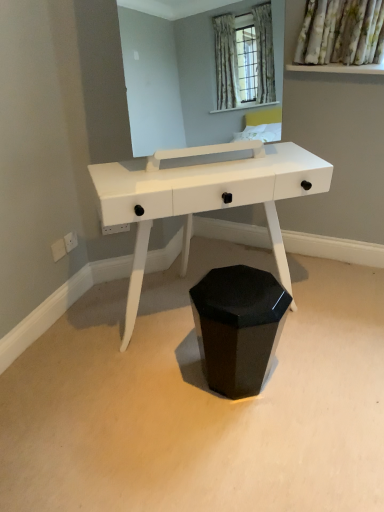
In order to face white glossy table at center, should I rotate leftwards or rightwards?

You should rotate right by 3.046 degrees.

Identify the location of white glossy table at center. (203, 197).

Describe the element at coordinates (203, 197) in the screenshot. I see `white glossy table at center` at that location.

Measure the distance between point (226, 198) and camera.

Point (226, 198) and camera are 5.21 feet apart from each other.

What is the approximate width of black glossy hexagonal waste bin at center?

Result: It is 30.12 centimeters.

Where is `black glossy hexagonal waste bin at center`? black glossy hexagonal waste bin at center is located at coordinates (238, 326).

The height and width of the screenshot is (512, 384). Describe the element at coordinates (238, 326) in the screenshot. I see `black glossy hexagonal waste bin at center` at that location.

The width and height of the screenshot is (384, 512). What are the coordinates of `white glossy table at center` in the screenshot? It's located at (203, 197).

Which object is positioned more to the right, black glossy hexagonal waste bin at center or white glossy table at center?

Positioned to the right is black glossy hexagonal waste bin at center.

Is black glossy hexagonal waste bin at center in front of white glossy table at center?

No, black glossy hexagonal waste bin at center is further to the viewer.

Is point (206, 285) behind point (126, 175)?

Yes, it is behind point (126, 175).

From the image's perspective, is black glossy hexagonal waste bin at center located above or below white glossy table at center?

From the image's perspective, black glossy hexagonal waste bin at center appears below white glossy table at center.

From a real-world perspective, which is physically below, black glossy hexagonal waste bin at center or white glossy table at center?

In real-world perspective, black glossy hexagonal waste bin at center is lower.

Is black glossy hexagonal waste bin at center wider or thinner than white glossy table at center?

black glossy hexagonal waste bin at center is thinner than white glossy table at center.

Based on the photo, considering the sizes of objects black glossy hexagonal waste bin at center and white glossy table at center in the image provided, who is shorter, black glossy hexagonal waste bin at center or white glossy table at center?

Standing shorter between the two is black glossy hexagonal waste bin at center.

Looking at the image, does black glossy hexagonal waste bin at center seem bigger or smaller compared to white glossy table at center?

Clearly, black glossy hexagonal waste bin at center is smaller in size than white glossy table at center.

Is white glossy table at center a part of black glossy hexagonal waste bin at center?

No, black glossy hexagonal waste bin at center does not contain white glossy table at center.

Is black glossy hexagonal waste bin at center far from white glossy table at center?

That's not correct — black glossy hexagonal waste bin at center is a little close to white glossy table at center.

In the scene shown: Is black glossy hexagonal waste bin at center positioned with its back to white glossy table at center?

black glossy hexagonal waste bin at center does not have its back to white glossy table at center.

How many degrees apart are the facing directions of black glossy hexagonal waste bin at center and white glossy table at center?

They differ by 173 degrees in their facing directions.

The height and width of the screenshot is (512, 384). Identify the location of waste container below the white glossy table at center (from a real-world perspective). (238, 326).

Considering the relative positions of white glossy table at center and black glossy hexagonal waste bin at center in the image provided, is white glossy table at center to the right of black glossy hexagonal waste bin at center from the viewer's perspective?

No, white glossy table at center is not to the right of black glossy hexagonal waste bin at center.

Between white glossy table at center and black glossy hexagonal waste bin at center, which one is positioned in front?

white glossy table at center is in front.

Does point (138, 263) appear closer or farther from the camera than point (252, 370)?

Point (138, 263) is farther from the camera than point (252, 370).

From the image's perspective, which object appears higher, white glossy table at center or black glossy hexagonal waste bin at center?

white glossy table at center appears higher in the image.

From a real-world perspective, is white glossy table at center positioned under black glossy hexagonal waste bin at center based on gravity?

No, from a real-world perspective, white glossy table at center is not below black glossy hexagonal waste bin at center.

Is white glossy table at center wider or thinner than black glossy hexagonal waste bin at center?

Considering their sizes, white glossy table at center looks broader than black glossy hexagonal waste bin at center.

Considering the sizes of white glossy table at center and black glossy hexagonal waste bin at center in the image, is white glossy table at center taller or shorter than black glossy hexagonal waste bin at center?

Considering their sizes, white glossy table at center has more height than black glossy hexagonal waste bin at center.

Between white glossy table at center and black glossy hexagonal waste bin at center, which one has larger size?

Bigger between the two is white glossy table at center.

Which is correct: white glossy table at center is inside black glossy hexagonal waste bin at center, or outside of it?

white glossy table at center exists outside the volume of black glossy hexagonal waste bin at center.

Looking at this image, is white glossy table at center in contact with black glossy hexagonal waste bin at center?

No, white glossy table at center is not beside black glossy hexagonal waste bin at center.

Is white glossy table at center positioned with its back to black glossy hexagonal waste bin at center?

No.

Measure the distance from white glossy table at center to black glossy hexagonal waste bin at center.

white glossy table at center and black glossy hexagonal waste bin at center are 15.11 inches apart from each other.

Identify the location of waste container directly beneath the white glossy table at center (from a real-world perspective). This screenshot has height=512, width=384. (238, 326).

Identify the location of waste container lying behind the white glossy table at center. The width and height of the screenshot is (384, 512). (238, 326).

Locate an element on the screen. table lying on the left of black glossy hexagonal waste bin at center is located at coordinates (203, 197).